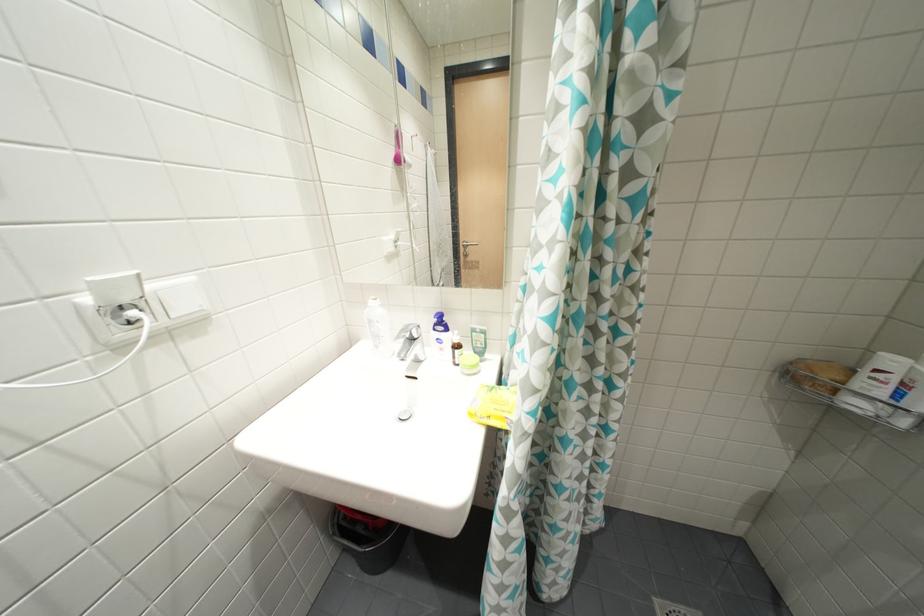
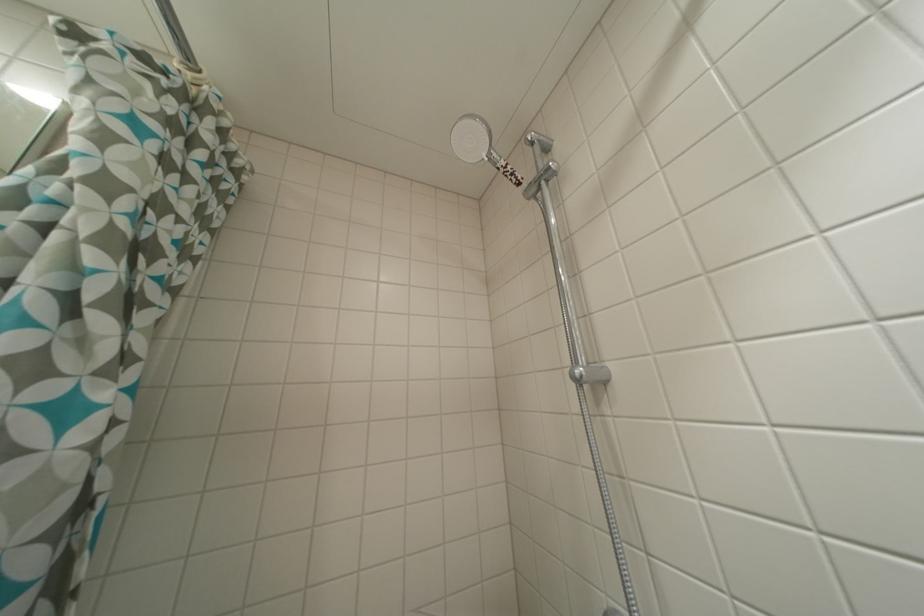
The images are taken continuously from a first-person perspective. In which direction is your viewpoint rotating?

The camera rotated toward right-up.